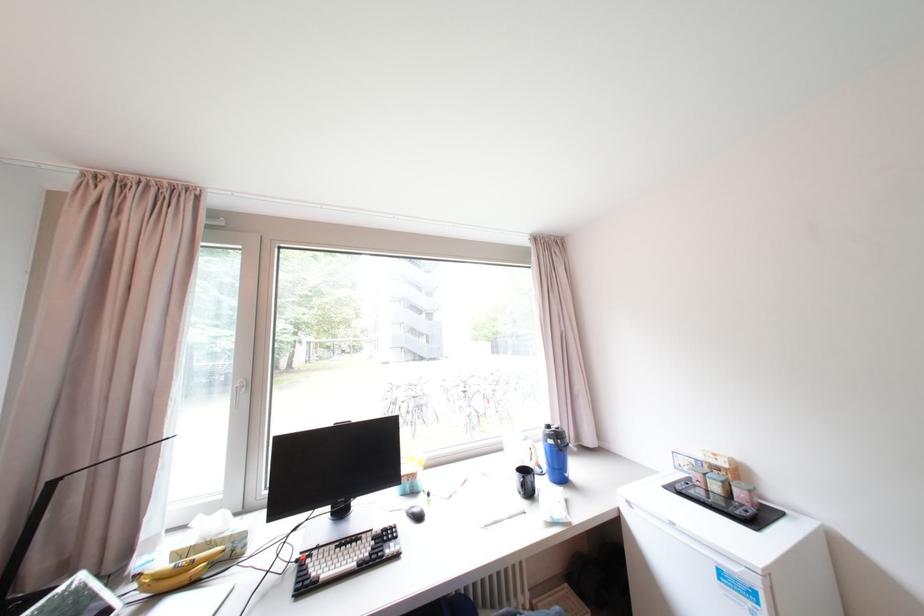
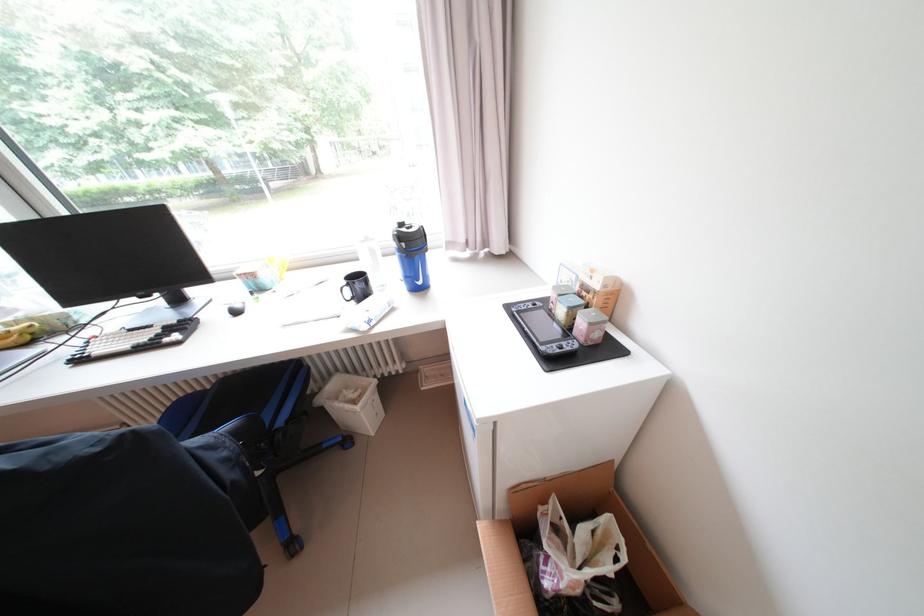
Locate, in the second image, the point that corresponds to (675,488) in the first image.

(516, 307)